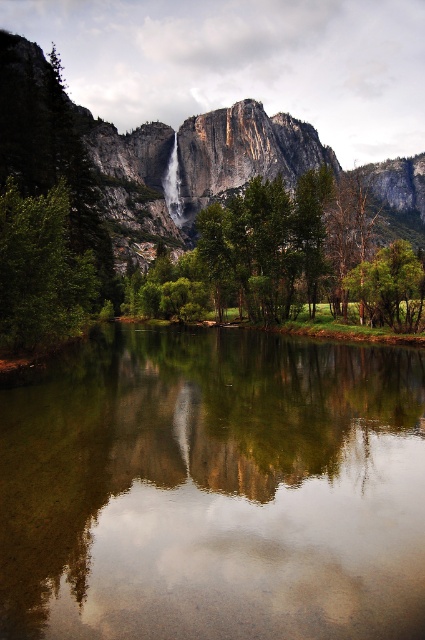
Which is more to the right, green reflective water at center or rocky cliff at center?

From the viewer's perspective, rocky cliff at center appears more on the right side.

Does green reflective water at center appear on the right side of rocky cliff at center?

Incorrect, green reflective water at center is not on the right side of rocky cliff at center.

Does point (159, 381) lie behind point (192, 179)?

No, (159, 381) is closer to viewer.

Locate an element on the screen. The width and height of the screenshot is (425, 640). green reflective water at center is located at coordinates (214, 490).

Does rocky cliff at center have a greater width compared to green matte tree at left?

Correct, the width of rocky cliff at center exceeds that of green matte tree at left.

Who is more distant from viewer, (124, 144) or (45, 246)?

Point (124, 144)

Which is behind, point (401, 202) or point (5, 218)?

The point (401, 202) is more distant.

Identify the location of rocky cliff at center. This screenshot has width=425, height=640. (84, 157).

Is point (231, 125) in front of point (384, 298)?

No, it is behind (384, 298).

Is rocky cliff at center smaller than green matte tree at lower right?

No, rocky cliff at center is not smaller than green matte tree at lower right.

Which is in front, point (314, 138) or point (376, 280)?

Point (376, 280) is in front.

The width and height of the screenshot is (425, 640). In order to click on rocky cliff at center in this screenshot , I will do `click(84, 157)`.